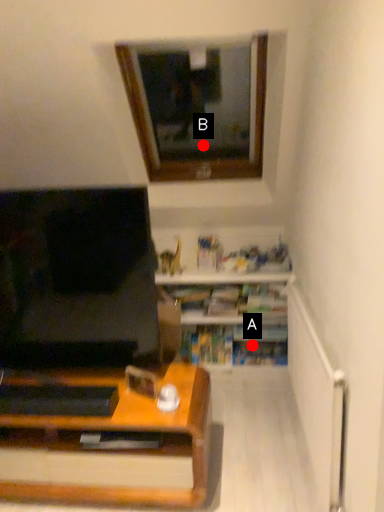
Question: Two points are circled on the image, labeled by A and B beside each circle. Which point is closer to the camera taking this photo?

Choices:
 (A) A is closer
 (B) B is closer

Answer: (A)